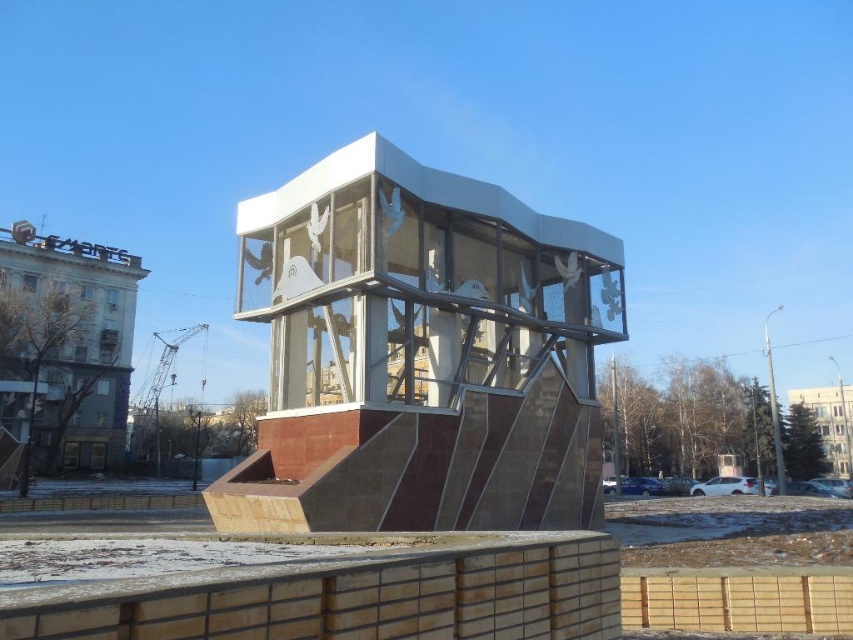
You are standing in front of the architectural structure and notice a point marked at coordinates (421, 355). What object is located at that position?

The point at coordinates (421, 355) indicates the location of the white glossy sculpture at center.

You are standing in front of the modern architectural structure and want to determine the relative positions of two points marked on the glass facade. Which point, point 1 at coordinates (578, 525) or point 2 at coordinates (314, 216), is closer to you?

Point 1 at coordinates (578, 525) is further to the viewer than point 2 at coordinates (314, 216), so point 2 is closer to you.

You are standing in front of the architectural structure and notice a white glossy sculpture at center. According to the coordinates provided, where exactly is the white glossy sculpture positioned relative to the structure?

The white glossy sculpture at center is located at point coordinates (421, 355), which places it near the center of the image, slightly to the right and just below the midpoint vertically.